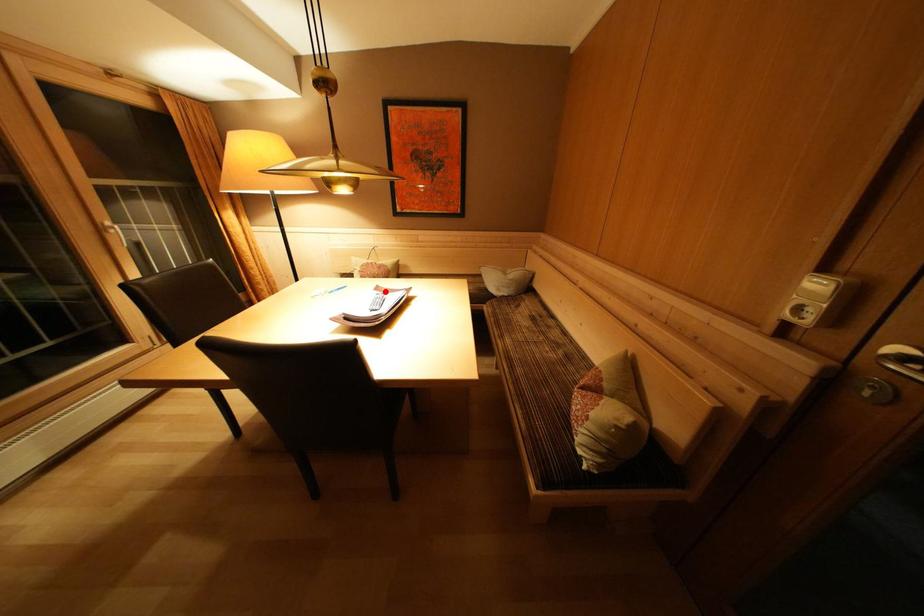
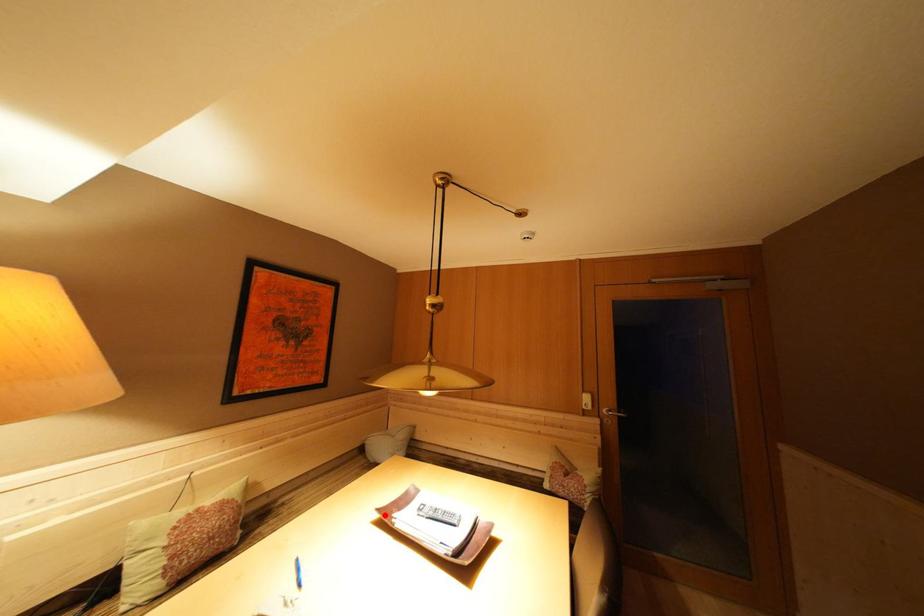
I am providing you with two images of the same scene from different viewpoints. A red point is marked on the first image and another point is marked on the second image. Are the points marked in image1 and image2 representing the same 3D position?

Yes